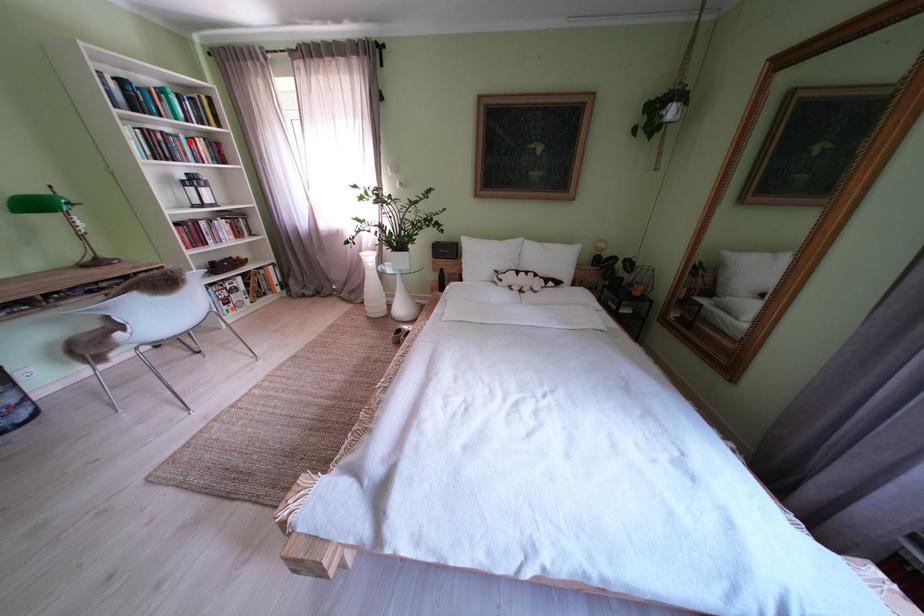
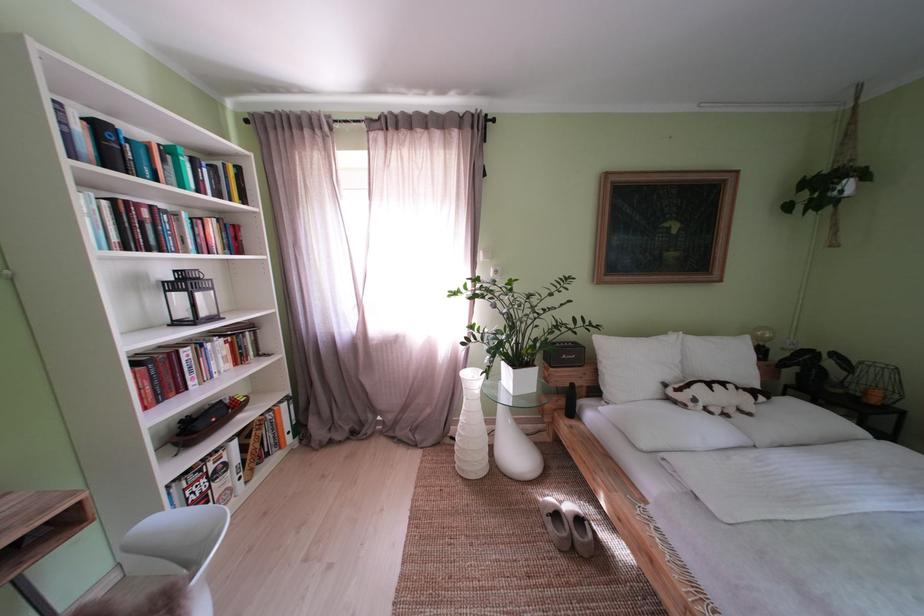
The point at the highlighted location is marked in the first image. Where is the corresponding point in the second image?

(188, 220)